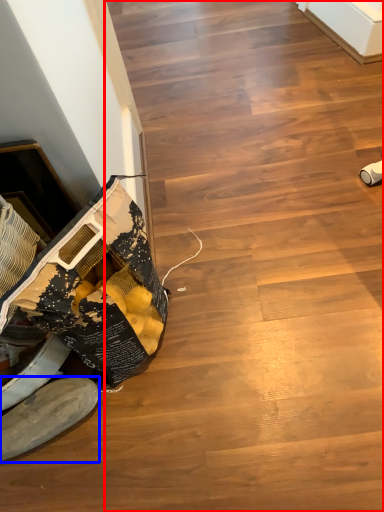
Question: Among these objects, which one is farthest to the camera, stairwell (highlighted by a red box) or footwear (highlighted by a blue box)?

Choices:
 (A) stairwell
 (B) footwear

Answer: (B)